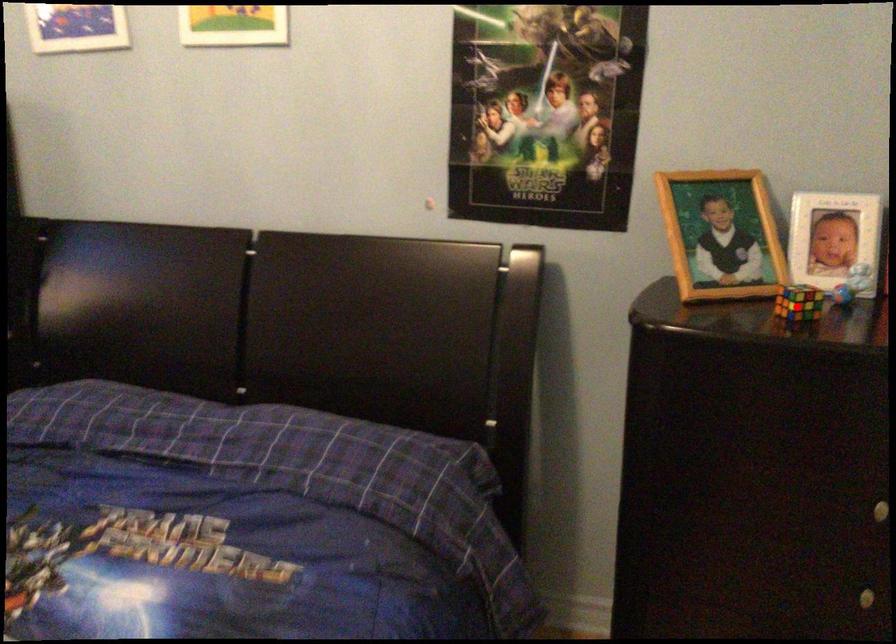
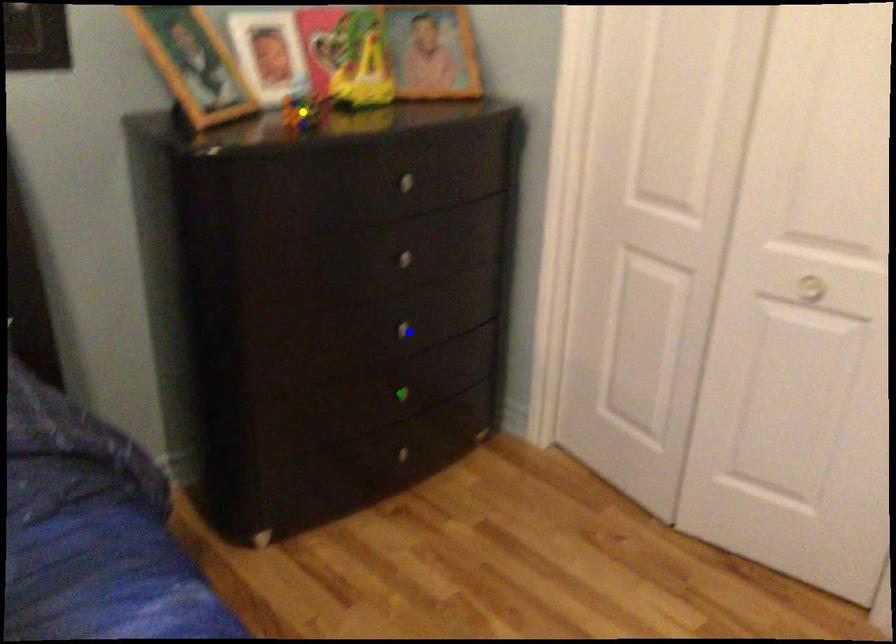
Question: I am providing you with two images of the same scene from different viewpoints. A red point is marked on the first image. You are given multiple points on the second image. Which mark in image 2 goes with the point in image 1?

Choices:
 (A) blue point
 (B) yellow point
 (C) green point

Answer: (B)